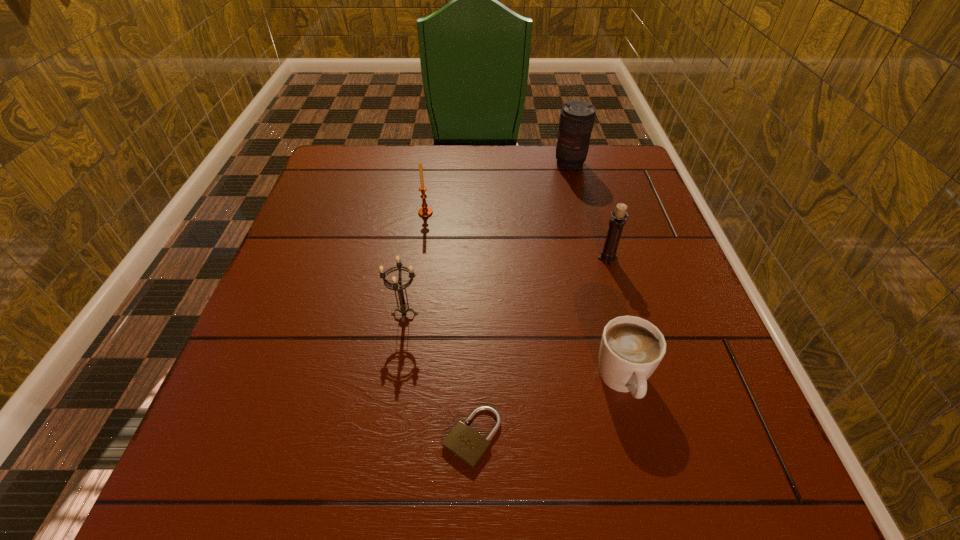
In the image, there is a desktop. Where is `vacant space at the far edge`? The image size is (960, 540). vacant space at the far edge is located at coordinates (521, 170).

Find the location of a particular element. Image resolution: width=960 pixels, height=540 pixels. vacant area at the left edge of the desktop is located at coordinates (265, 313).

The width and height of the screenshot is (960, 540). In the image, there is a desktop. What are the coordinates of `vacant space at the right edge` in the screenshot? It's located at (668, 240).

Locate an element on the screen. The width and height of the screenshot is (960, 540). vacant position at the far left corner of the desktop is located at coordinates (336, 185).

Image resolution: width=960 pixels, height=540 pixels. Identify the location of vacant space at the near left corner of the desktop. (235, 465).

I want to click on vacant space at the far right corner of the desktop, so click(x=625, y=178).

What are the coordinates of `free point between the padlock and the farthest object` in the screenshot? It's located at (520, 301).

Find the location of a particular element. The image size is (960, 540). vacant area between the fourth farthest object and the fourth nearest object is located at coordinates (506, 286).

Image resolution: width=960 pixels, height=540 pixels. I want to click on free space between the cappuccino and the padlock, so click(x=547, y=409).

Find the location of `vacant area between the fifth nearest object and the third object from left to right`. vacant area between the fifth nearest object and the third object from left to right is located at coordinates (448, 325).